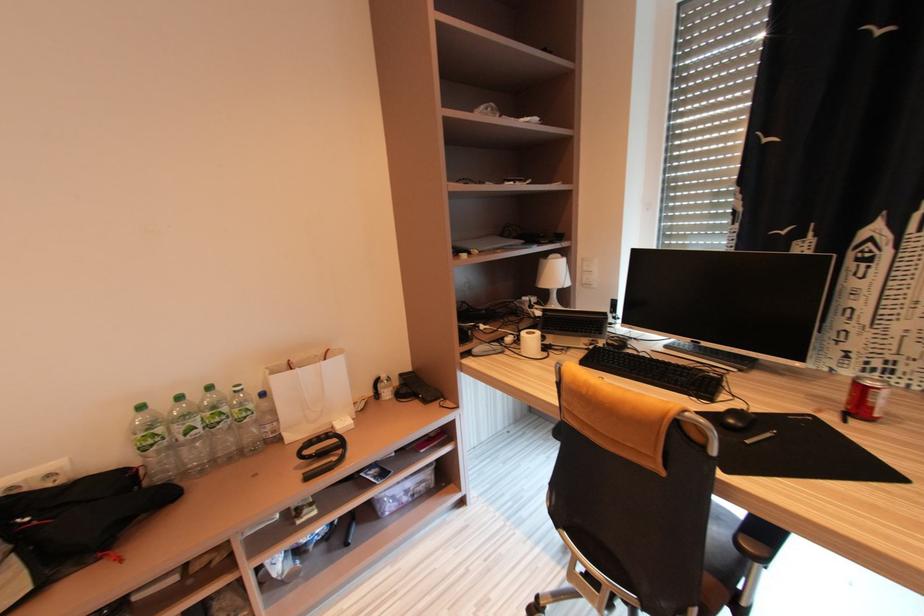
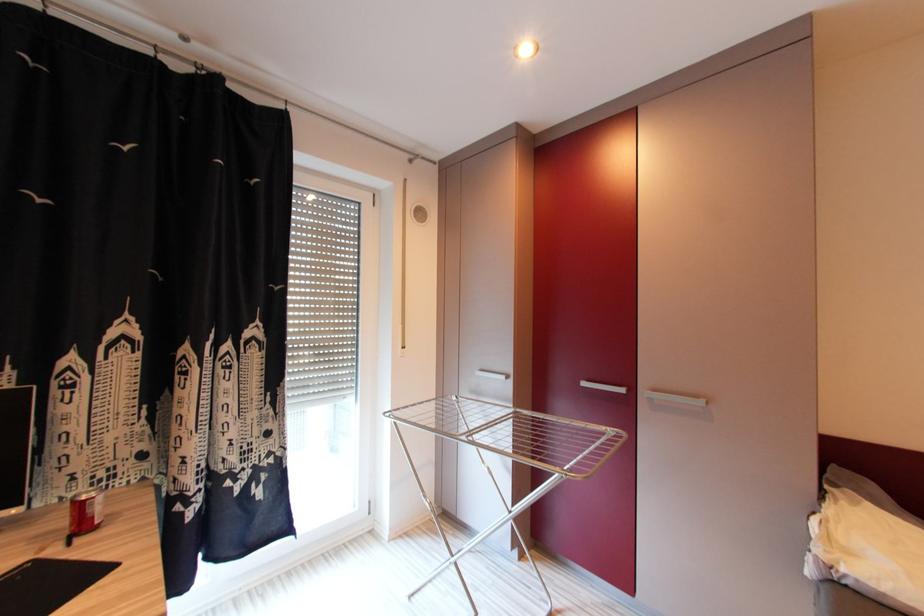
Question: The first image is from the beginning of the video and the second image is from the end. How did the camera likely rotate when shooting the video?

Choices:
 (A) Left
 (B) Right
 (C) Up
 (D) Down

Answer: (B)